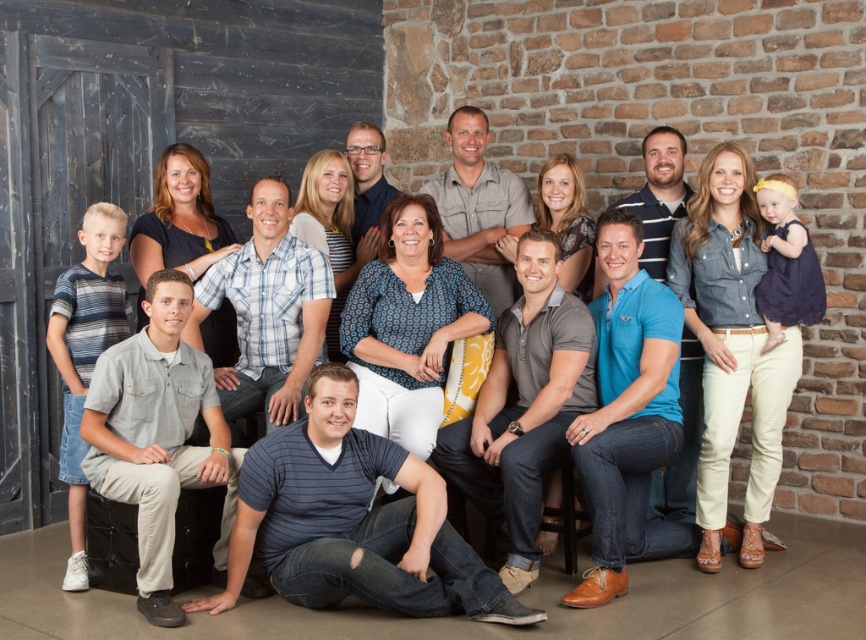
You are taking a photo and need to arrange two shirts in the scene. The striped cotton shirt at center and the blue striped shirt at center must be positioned according to their actual locations. Which shirt should be placed to the left of the other?

The striped cotton shirt at center should be placed to the left of the blue striped shirt at center as per the description.